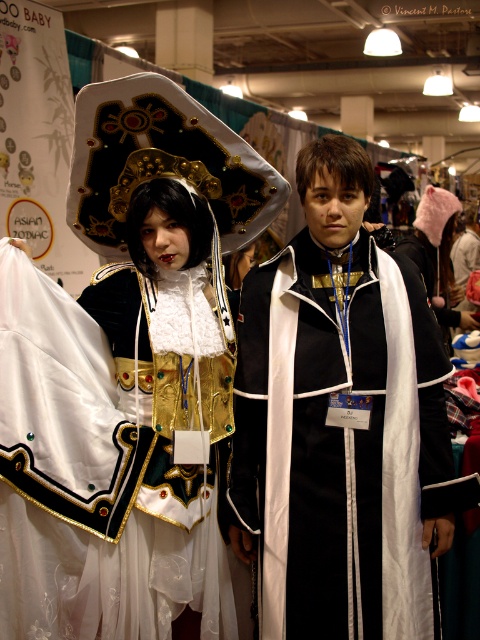
Who is higher up, shiny gold armor at center or matte black coat at center?

matte black coat at center is higher up.

In the scene shown: Is shiny gold armor at center positioned behind matte black coat at center?

No, shiny gold armor at center is in front of matte black coat at center.

Which is behind, point (56, 396) or point (338, 596)?

Point (338, 596)

You are a GUI agent. You are given a task and a screenshot of the screen. Output one action in this format:
    pyautogui.click(x=<x>, y=<y>)
    Task: Click on the shiny gold armor at center
    The width and height of the screenshot is (480, 640).
    Given the screenshot: What is the action you would take?
    pyautogui.click(x=119, y=436)